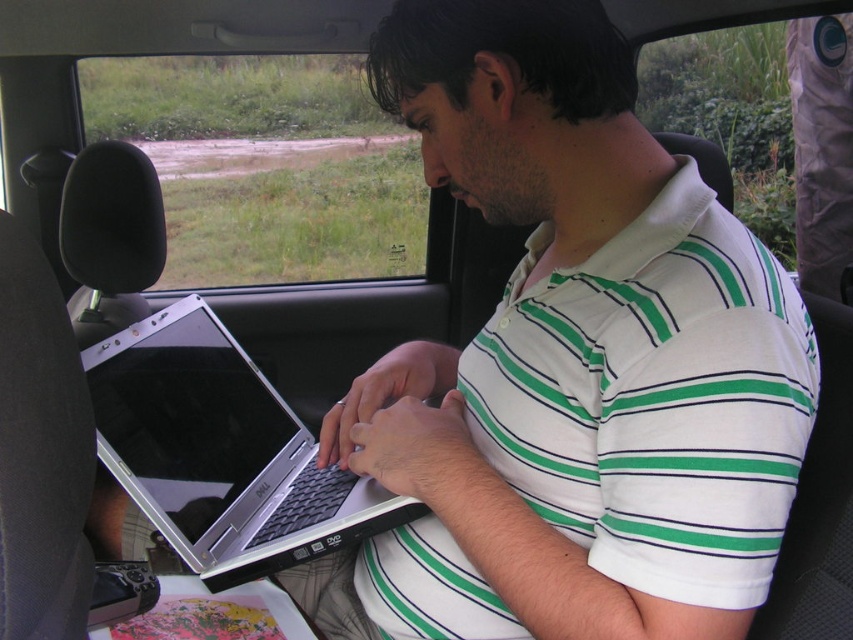
You are a passenger in the car and want to point out two specific points outside the window. The first point is at coordinates point (788, 310) and the second is at point (184, 387). From your perspective inside the car, which point is closer to you?

Point (788, 310) is in front of point (184, 387), so it is closer to you.

You are a passenger in the car and want to hand a document to the person wearing the white striped polo shirt at center and using the silver metallic laptop at center. Which object should you reach toward first to ensure you can hand the document without obstructing their work?

You should reach toward the white striped polo shirt at center first because it is closer to you than the silver metallic laptop at center, so you can hand the document directly to them without interfering with the laptop.

You are a delivery driver who needs to attach a GPS tracker to your car. The GPS tracker has a diameter of 4 inches. You want to place it at the point with coordinates point (704, 333). Will the GPS tracker fit at this location without overlapping any objects in the image?

The point (704, 333) is 25.11 inches away from the camera. Since the GPS tracker has a diameter of 4 inches, it can be placed at this location as there is sufficient space and no overlapping with other objects.